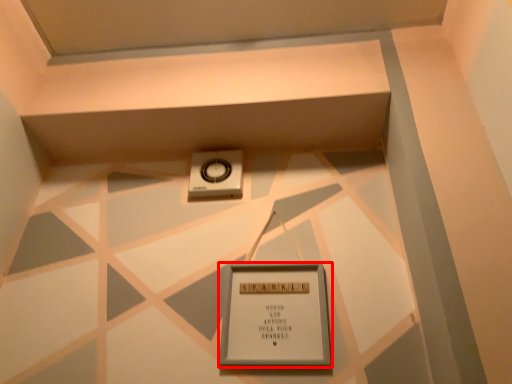
Question: Observing the image, what is the correct spatial positioning of picture frame (annotated by the red box) in reference to weight scale?

Choices:
 (A) left
 (B) right

Answer: (B)